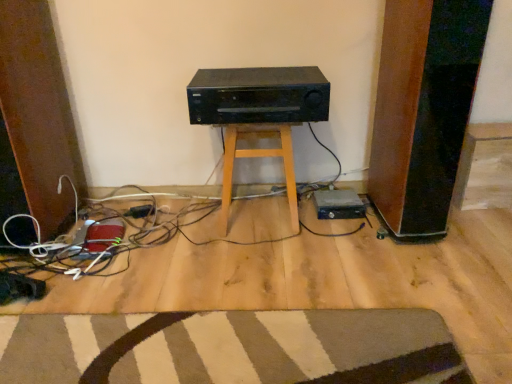
Question: From their relative heights in the image, would you say black plastic hard drive at lower right is taller or shorter than black matte stereo at center?

Choices:
 (A) tall
 (B) short

Answer: (B)

Question: Is black plastic hard drive at lower right to the left or to the right of black matte stereo at center in the image?

Choices:
 (A) right
 (B) left

Answer: (A)

Question: Which object is positioned closest to the striped carpet at lower center?

Choices:
 (A) black plastic hard drive at lower right
 (B) black matte stereo at center
 (C) wooden stool at center
 (D) black plastic plug at lower center

Answer: (C)

Question: Which is farther from the striped carpet at lower center?

Choices:
 (A) black matte stereo at center
 (B) black plastic hard drive at lower right
 (C) wooden stool at center
 (D) black plastic plug at lower center

Answer: (D)